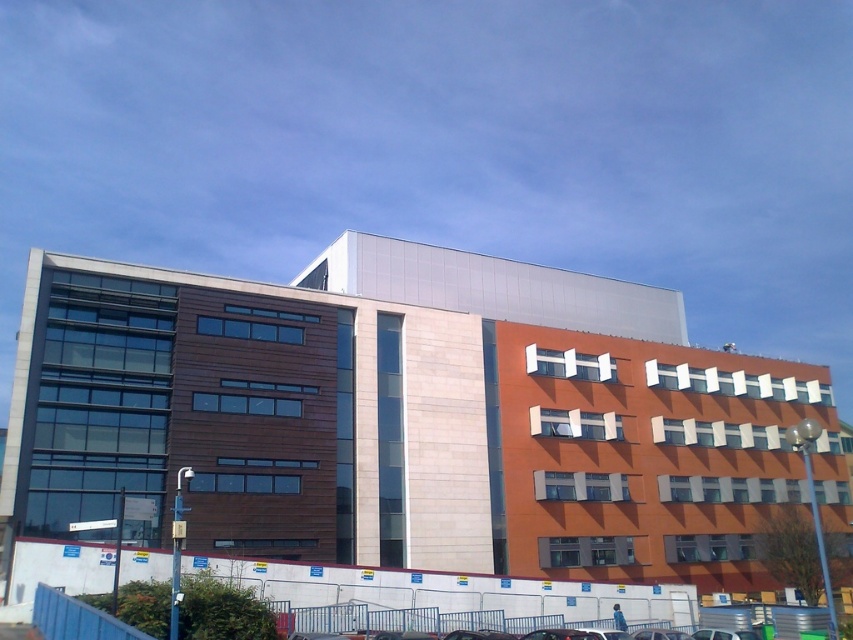
Question: Can you confirm if metallic silver car at lower center is positioned to the right of shiny black car at center?

Choices:
 (A) no
 (B) yes

Answer: (A)

Question: Where is metallic silver car at lower center located in relation to shiny black car at center in the image?

Choices:
 (A) below
 (B) above

Answer: (A)

Question: Which point is farther to the camera?

Choices:
 (A) (724, 634)
 (B) (654, 628)

Answer: (B)

Question: Which point appears closest to the camera in this image?

Choices:
 (A) (639, 636)
 (B) (492, 634)

Answer: (B)

Question: Observing the image, what is the correct spatial positioning of metallic silver car at lower center in reference to shiny black car at center?

Choices:
 (A) left
 (B) right

Answer: (A)